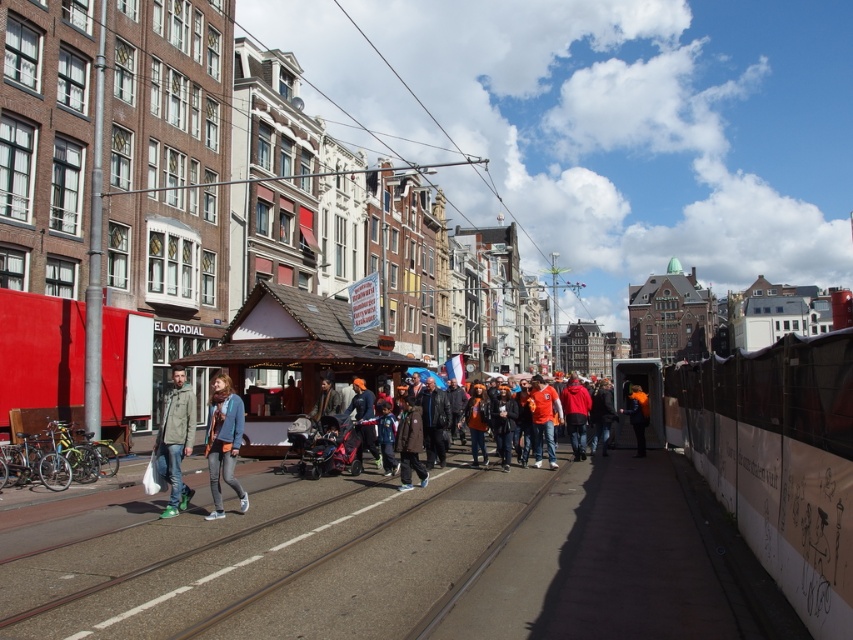
You are a delivery person who needs to place a package on the orange leather jacket at center without disturbing the dark brown leather jacket at center. Is this possible?

The dark brown leather jacket at center is above the orange leather jacket at center, so the package can be placed on the orange leather jacket at center without disturbing the dark brown one as it is positioned above.